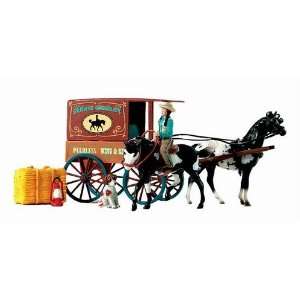
Locate an element on the screen. The width and height of the screenshot is (300, 300). white apron is located at coordinates (57, 192).